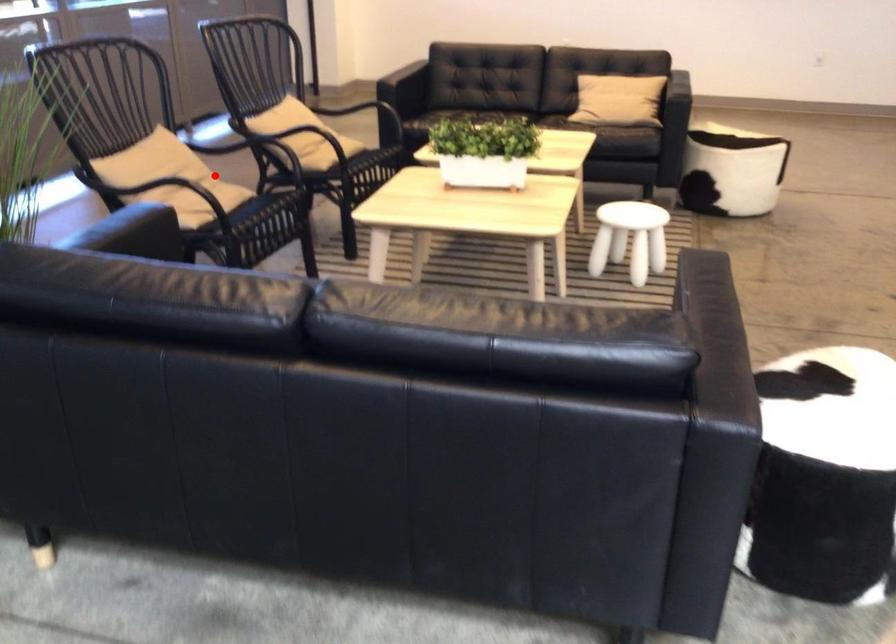
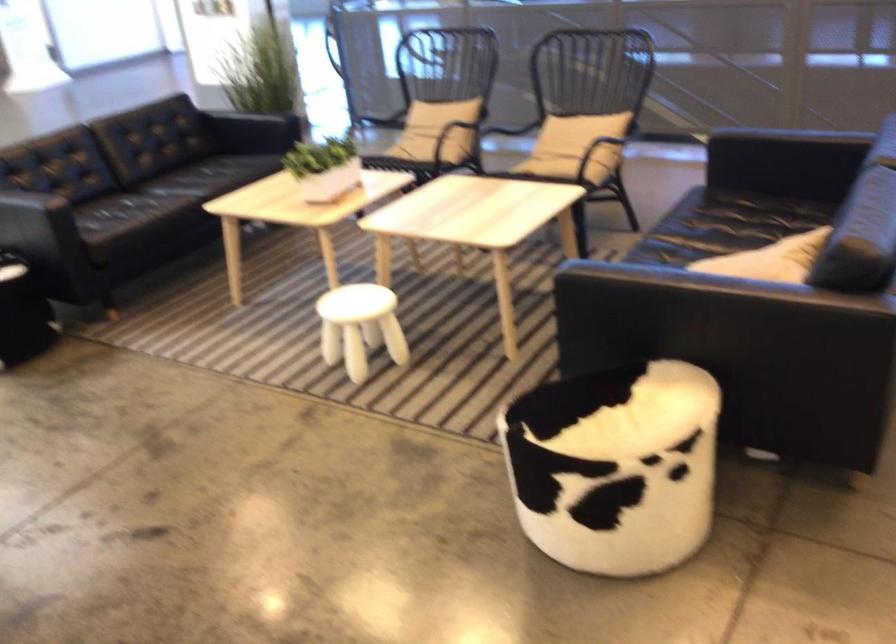
Question: I am providing you with two images of the same scene from different viewpoints. Given a red point in image1, look at the same physical point in image2. Is it:

Choices:
 (A) Closer to the viewpoint
 (B) Farther from the viewpoint

Answer: (B)